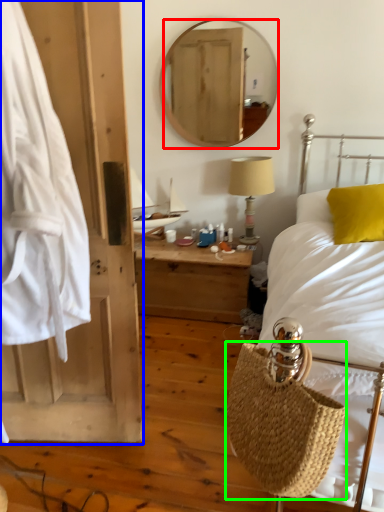
Question: Which object is the farthest from mirror (highlighted by a red box)? Choose among these: barn door (highlighted by a blue box) or basket (highlighted by a green box).

Choices:
 (A) barn door
 (B) basket

Answer: (B)